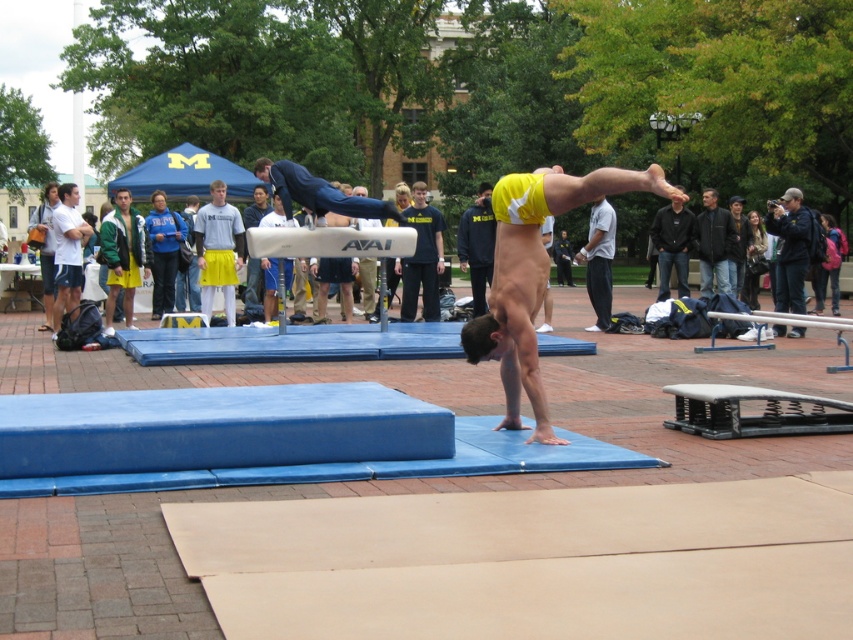
You are a photographer at the event and need to capture a photo of both the dark blue shirt at center and the gray cotton shirt at center in the midground without any obstruction. Based on their heights, which one should you focus on first to ensure both are visible?

The dark blue shirt at center is shorter than the gray cotton shirt at center. To ensure both are visible without obstruction, focus on the gray cotton shirt at center first since it is taller, allowing the shorter dark blue shirt at center to be captured below it.

You are a photographer positioned at the edge of the event area. You need to capture a photo of the yellow athletic shorts at center without the silver metallic balance beam at center appearing in the frame. Is this possible given their positions?

The silver metallic balance beam at center is to the left of yellow athletic shorts at center. Since the beam is positioned to the left of the shorts, you can aim your camera to the right side of the shorts to exclude the beam from the frame.